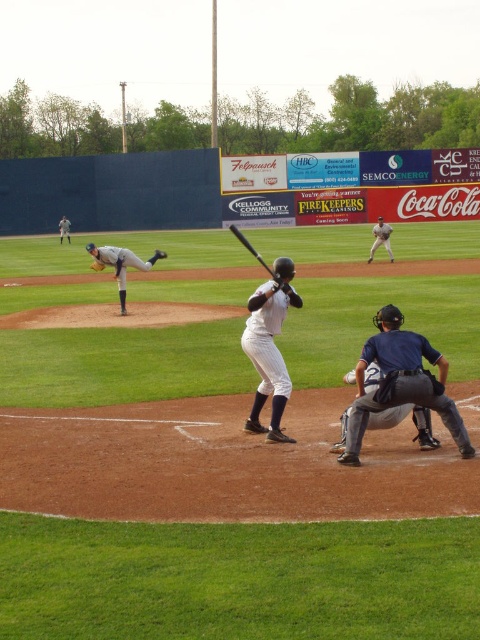
From the picture: You are a baseball player trying to grab your equipment quickly. You see the black matte bat at center and the brown leather glove at center. Which one is positioned higher?

The black matte bat at center is located above the brown leather glove at center, so it is positioned higher.

In the scene shown: You are a baseball player standing at home plate and you see the black matte bat at center and the brown leather glove at center. Which object is closer to you?

The black matte bat at center is closer to you because it is in front of the brown leather glove at center.

You are a spectator at the baseball game and want to take a photo of the gray uniformed pitcher at center and the brown leather glove at upper left. Based on their positions, which object is higher in the image?

The gray uniformed pitcher at center is higher in the image than the brown leather glove at upper left because the gray uniformed pitcher at center is located above the brown leather glove at upper left.